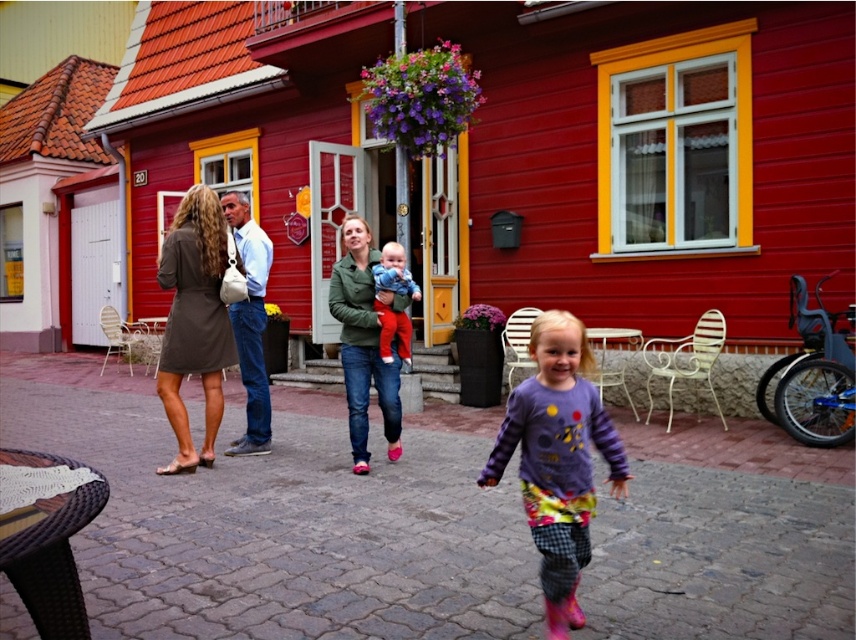
Question: Which point is farther to the camera?

Choices:
 (A) pyautogui.click(x=191, y=451)
 (B) pyautogui.click(x=389, y=248)
 (C) pyautogui.click(x=581, y=346)

Answer: (A)

Question: Is purple fleece jacket at center above matte brown dress at center?

Choices:
 (A) no
 (B) yes

Answer: (A)

Question: Which object is the farthest from the green matte jacket at center?

Choices:
 (A) matte blue sweater at center
 (B) matte brown dress at center
 (C) purple fleece jacket at center

Answer: (C)

Question: Which of these objects is positioned closest to the purple fleece jacket at center?

Choices:
 (A) matte brown dress at center
 (B) matte blue sweater at center
 (C) green matte jacket at center

Answer: (B)

Question: Is green matte jacket at center thinner than matte blue sweater at center?

Choices:
 (A) no
 (B) yes

Answer: (A)

Question: Does purple fleece jacket at center come behind matte brown dress at center?

Choices:
 (A) no
 (B) yes

Answer: (A)